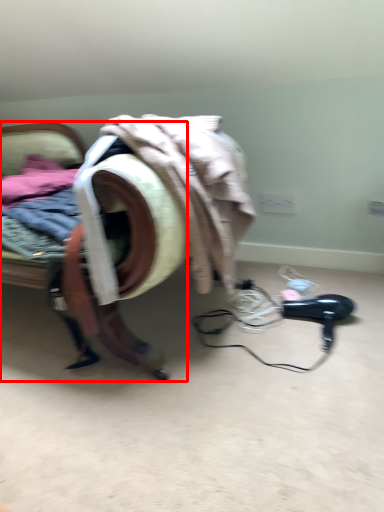
Question: From the image, what is the correct spatial relationship of furniture (annotated by the red box) in relation to hair drier?

Choices:
 (A) left
 (B) right

Answer: (A)